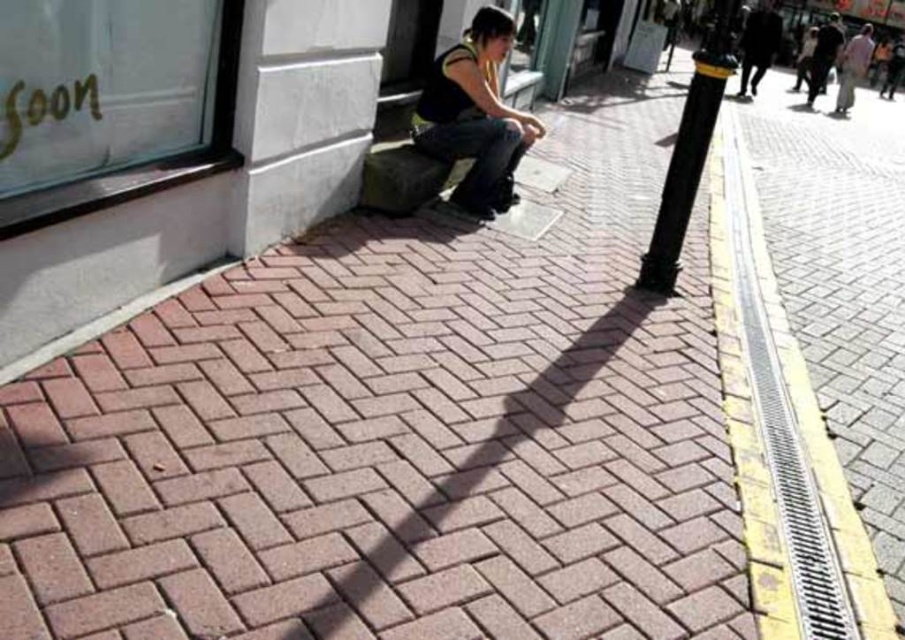
You are a delivery person who needs to place a small package on the widest object between the yellow textured curb at lower right and the dark fabric jacket at upper right. Which object should you choose?

The yellow textured curb at lower right is wider than the dark fabric jacket at upper right, so you should place the package on the yellow textured curb at lower right.

You are standing on the brick sidewalk and want to cross the street. The yellow textured curb at lower right marks the pedestrian crossing. Which direction should you walk to reach it from your current position?

The yellow textured curb at lower right is located at point (783, 436), so you should walk towards the lower right direction to reach it.

Looking at this image, you are a delivery person trying to place a box on the yellow textured curb at lower right. The box is as tall as the denim jeans at center. Will the box fit on top of the curb without hanging over?

The yellow textured curb at lower right is taller than denim jeans at center. Since the box is as tall as the denim jeans at center, it will not fit on top of the curb without hanging over because the curb is taller than the box.